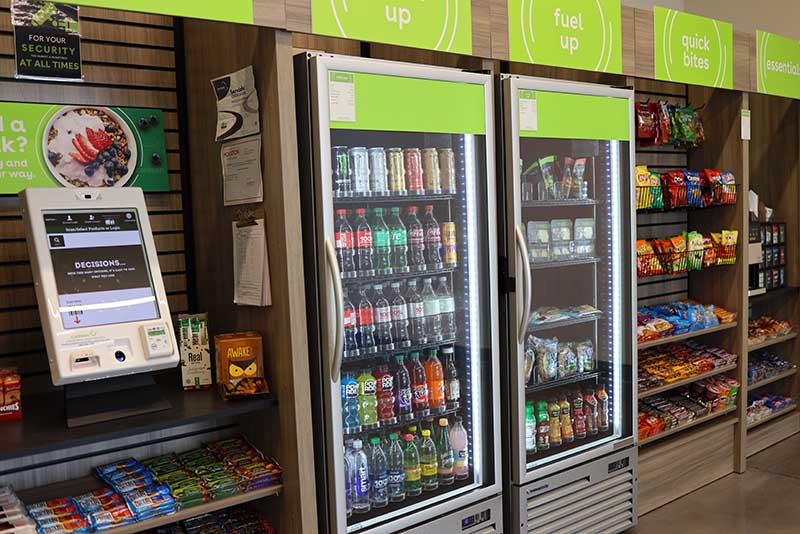
I want to click on fridges, so click(302, 86), click(505, 92).